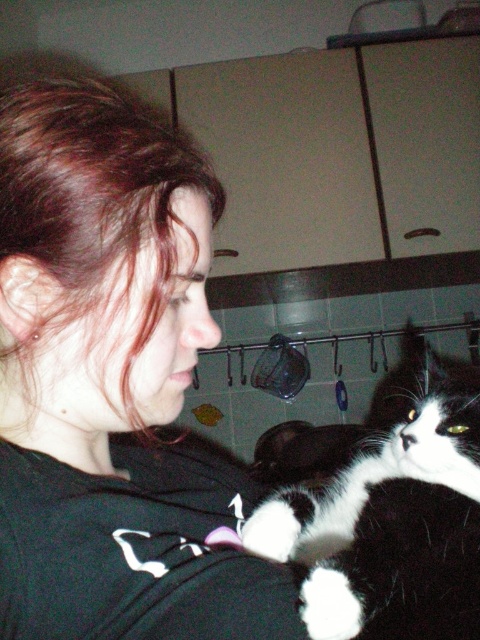
Question: Which is nearer to the black matte shirt at center?

Choices:
 (A) black and white fur at lower right
 (B) white fur paw at shoulder

Answer: (A)

Question: Is black matte shirt at center wider than white fur paw at shoulder?

Choices:
 (A) yes
 (B) no

Answer: (A)

Question: Considering the relative positions of black and white fur at lower right and white fur paw at shoulder in the image provided, where is black and white fur at lower right located with respect to white fur paw at shoulder?

Choices:
 (A) below
 (B) above

Answer: (B)

Question: Which object is farther from the camera taking this photo?

Choices:
 (A) black and white fur at lower right
 (B) black matte shirt at center

Answer: (A)

Question: Does black matte shirt at center appear under black and white fur at lower right?

Choices:
 (A) no
 (B) yes

Answer: (A)

Question: Among these points, which one is farthest from the camera?

Choices:
 (A) (417, 467)
 (B) (98, 419)

Answer: (A)